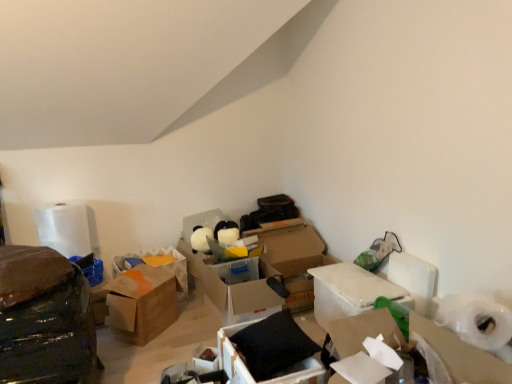
Where is `translucent plastic container at center, which is the third box in left-to-right order`? This screenshot has height=384, width=512. translucent plastic container at center, which is the third box in left-to-right order is located at coordinates (232, 288).

Describe the element at coordinates (141, 304) in the screenshot. I see `brown cardboard box at center, placed as the 4th box when sorted from right to left` at that location.

In order to click on black matte pillow at center, which is the 2th box in right-to-left order in this screenshot , I will do `click(269, 350)`.

Locate an element on the screen. Image resolution: width=512 pixels, height=384 pixels. cardboard box at lower right is located at coordinates [461, 355].

This screenshot has height=384, width=512. Describe the element at coordinates (205, 359) in the screenshot. I see `matte cardboard box at center` at that location.

Find the location of `translucent plastic container at center, which ranks as the third box in right-to-left order`. translucent plastic container at center, which ranks as the third box in right-to-left order is located at coordinates (232, 288).

Is shiny black plastic bag at left located outside brown cardboard box at center, which is the 5th box in right-to-left order?

Absolutely, shiny black plastic bag at left is external to brown cardboard box at center, which is the 5th box in right-to-left order.

Is shiny black plastic bag at left facing towards brown cardboard box at center, which is the 5th box in right-to-left order?

No.

Does shiny black plastic bag at left have a larger size compared to brown cardboard box at center, which is the 5th box in right-to-left order?

Yes, shiny black plastic bag at left is bigger than brown cardboard box at center, which is the 5th box in right-to-left order.

From a real-world perspective, is shiny black plastic bag at left on brown cardboard box at center, the 1th box when ordered from left to right?

Yes, from a real-world perspective, shiny black plastic bag at left is above brown cardboard box at center, the 1th box when ordered from left to right.

Is white plastic toilet paper at lower right, positioned as the 2th toilet paper in left-to-right order, in front of or behind brown cardboard box at center, the second box from the left, in the image?

white plastic toilet paper at lower right, positioned as the 2th toilet paper in left-to-right order, is positioned closer to the viewer than brown cardboard box at center, the second box from the left.

Looking at this image, is white plastic toilet paper at lower right, which is the 2th toilet paper from back to front, taller than brown cardboard box at center, placed as the 4th box when sorted from right to left?

No.

Is white plastic toilet paper at lower right, placed as the first toilet paper when sorted from front to back, wider than brown cardboard box at center, placed as the 4th box when sorted from right to left?

Yes, white plastic toilet paper at lower right, placed as the first toilet paper when sorted from front to back, is wider than brown cardboard box at center, placed as the 4th box when sorted from right to left.

How different are the orientations of white plastic toilet paper at lower right, positioned as the 2th toilet paper in left-to-right order, and brown cardboard box at center, placed as the 4th box when sorted from right to left, in degrees?

The angle between the facing direction of white plastic toilet paper at lower right, positioned as the 2th toilet paper in left-to-right order, and the facing direction of brown cardboard box at center, placed as the 4th box when sorted from right to left, is 132 degrees.

From a real-world perspective, who is located lower, brown cardboard box at center, the 1th box when ordered from left to right, or white plastic toilet paper at lower right, positioned as the 2th toilet paper in left-to-right order?

brown cardboard box at center, the 1th box when ordered from left to right, is physically lower.

Is brown cardboard box at center, the 1th box when ordered from left to right, to the right of white plastic toilet paper at lower right, positioned as the 2th toilet paper in left-to-right order, from the viewer's perspective?

Incorrect, brown cardboard box at center, the 1th box when ordered from left to right, is not on the right side of white plastic toilet paper at lower right, positioned as the 2th toilet paper in left-to-right order.

In terms of height, does brown cardboard box at center, the 1th box when ordered from left to right, look taller or shorter compared to white plastic toilet paper at lower right, placed as the first toilet paper when sorted from right to left?

Considering their sizes, brown cardboard box at center, the 1th box when ordered from left to right, has less height than white plastic toilet paper at lower right, placed as the first toilet paper when sorted from right to left.

Is shiny black plastic bag at left surrounding black matte pillow at center, which is the 2th box in right-to-left order?

No.

Between shiny black plastic bag at left and black matte pillow at center, the 4th box in the left-to-right sequence, which one has larger width?

shiny black plastic bag at left.

From a real-world perspective, is shiny black plastic bag at left located higher than black matte pillow at center, the 4th box in the left-to-right sequence?

Indeed, from a real-world perspective, shiny black plastic bag at left stands above black matte pillow at center, the 4th box in the left-to-right sequence.

Is shiny black plastic bag at left turned away from black matte pillow at center, which is the 2th box in right-to-left order?

No, black matte pillow at center, which is the 2th box in right-to-left order, is not at the back of shiny black plastic bag at left.

Looking at this image, is translucent plastic container at center, which ranks as the third box in right-to-left order, shorter than shiny black plastic bag at left?

Indeed, translucent plastic container at center, which ranks as the third box in right-to-left order, has a lesser height compared to shiny black plastic bag at left.

Is translucent plastic container at center, which is the third box in left-to-right order, facing towards shiny black plastic bag at left?

No, translucent plastic container at center, which is the third box in left-to-right order, is not aimed at shiny black plastic bag at left.

From a real-world perspective, is translucent plastic container at center, which ranks as the third box in right-to-left order, physically located above or below shiny black plastic bag at left?

translucent plastic container at center, which ranks as the third box in right-to-left order, is below shiny black plastic bag at left.

Does point (278, 310) lie in front of point (88, 332)?

No, it is not.

Does cardboard box at lower right turn towards black matte pillow at center, which is the 2th box in right-to-left order?

No.

Considering the points (473, 368) and (228, 376), which point is in front, point (473, 368) or point (228, 376)?

The point (473, 368) is closer.

Is cardboard box at lower right thinner than black matte pillow at center, the 4th box in the left-to-right sequence?

Correct, the width of cardboard box at lower right is less than that of black matte pillow at center, the 4th box in the left-to-right sequence.

Does cardboard box at lower right lie behind black matte pillow at center, the 4th box in the left-to-right sequence?

That is False.

Is translucent plastic container at center, which is the third box in left-to-right order, further to the viewer compared to matte cardboard box at center?

Yes, translucent plastic container at center, which is the third box in left-to-right order, is further from the viewer.

Between translucent plastic container at center, which is the third box in left-to-right order, and matte cardboard box at center, which one has larger width?

Wider between the two is translucent plastic container at center, which is the third box in left-to-right order.

Is translucent plastic container at center, which ranks as the third box in right-to-left order, facing away from matte cardboard box at center?

That's not correct — translucent plastic container at center, which ranks as the third box in right-to-left order, is not looking away from matte cardboard box at center.

From their relative heights in the image, would you say translucent plastic container at center, which ranks as the third box in right-to-left order, is taller or shorter than matte cardboard box at center?

Clearly, translucent plastic container at center, which ranks as the third box in right-to-left order, is taller compared to matte cardboard box at center.

What are the coordinates of `garbage in front of the brown cardboard box at center, which is the 5th box in right-to-left order` in the screenshot? It's located at (44, 318).

I want to click on toilet paper to the right of brown cardboard box at center, placed as the 4th box when sorted from right to left, so click(x=476, y=319).

From the image, which object appears to be nearer to cardboard box at lower right, black matte pillow at center, the 4th box in the left-to-right sequence, or matte cardboard box at center?

Based on the image, black matte pillow at center, the 4th box in the left-to-right sequence, appears to be nearer to cardboard box at lower right.

Which object lies nearer to the anchor point shiny black plastic bag at left, white plastic toilet paper at lower right, positioned as the 2th toilet paper in left-to-right order, or translucent plastic container at center, which is the third box in left-to-right order?

The object closer to shiny black plastic bag at left is translucent plastic container at center, which is the third box in left-to-right order.

Based on their spatial positions, is shiny black plastic bag at left or white glossy toilet paper at upper left, the first toilet paper in the back-to-front sequence, further from brown cardboard box at center, the 1th box when ordered from left to right?

The object further to brown cardboard box at center, the 1th box when ordered from left to right, is shiny black plastic bag at left.

Looking at the image, which one is located further to white cardboard box at center-right, which is the 1th box from right to left, cardboard box at lower right or white glossy toilet paper at upper left, placed as the second toilet paper when sorted from front to back?

Based on the image, white glossy toilet paper at upper left, placed as the second toilet paper when sorted from front to back, appears to be further to white cardboard box at center-right, which is the 1th box from right to left.

Based on their spatial positions, is shiny black plastic bag at left or cardboard box at lower right further from black matte pillow at center, the 4th box in the left-to-right sequence?

The object further to black matte pillow at center, the 4th box in the left-to-right sequence, is shiny black plastic bag at left.

Estimate the real-world distances between objects in this image. Which object is closer to white plastic toilet paper at lower right, placed as the first toilet paper when sorted from right to left, brown cardboard box at center, the second box from the left, or translucent plastic container at center, which ranks as the third box in right-to-left order?

translucent plastic container at center, which ranks as the third box in right-to-left order, lies closer to white plastic toilet paper at lower right, placed as the first toilet paper when sorted from right to left, than the other object.

Which object lies further to the anchor point matte cardboard box at center, white cardboard box at center-right, which is the 1th box from right to left, or white glossy toilet paper at upper left, positioned as the first toilet paper in left-to-right order?

Based on the image, white glossy toilet paper at upper left, positioned as the first toilet paper in left-to-right order, appears to be further to matte cardboard box at center.

Based on their spatial positions, is white plastic toilet paper at lower right, which is the 2th toilet paper from back to front, or white cardboard box at center-right, which is the 1th box from right to left, closer to shiny black plastic bag at left?

Based on the image, white cardboard box at center-right, which is the 1th box from right to left, appears to be nearer to shiny black plastic bag at left.

Locate an element on the screen. cardboard box situated between white glossy toilet paper at upper left, placed as the second toilet paper when sorted from front to back, and white plastic toilet paper at lower right, placed as the first toilet paper when sorted from front to back, from left to right is located at coordinates (461, 355).

Locate an element on the screen. The height and width of the screenshot is (384, 512). box between brown cardboard box at center, which is the 5th box in right-to-left order, and translucent plastic container at center, which is the third box in left-to-right order, from left to right is located at coordinates (141, 304).

The height and width of the screenshot is (384, 512). I want to click on storage box situated between white glossy toilet paper at upper left, the first toilet paper in the back-to-front sequence, and translucent plastic container at center, which ranks as the third box in right-to-left order, from left to right, so click(205, 359).

This screenshot has width=512, height=384. In order to click on garbage between white glossy toilet paper at upper left, positioned as the first toilet paper in left-to-right order, and cardboard box at lower right from left to right in this screenshot , I will do `click(44, 318)`.